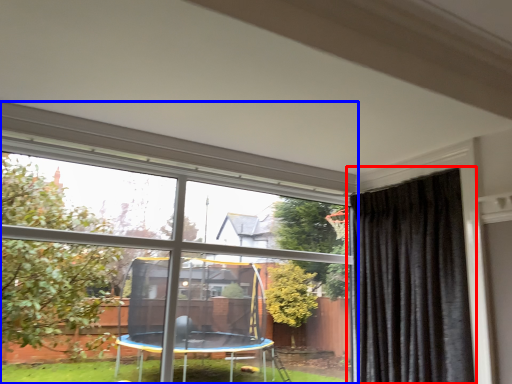
Question: Which of the following is the farthest to the observer, curtain (highlighted by a red box) or window (highlighted by a blue box)?

Choices:
 (A) curtain
 (B) window

Answer: (A)